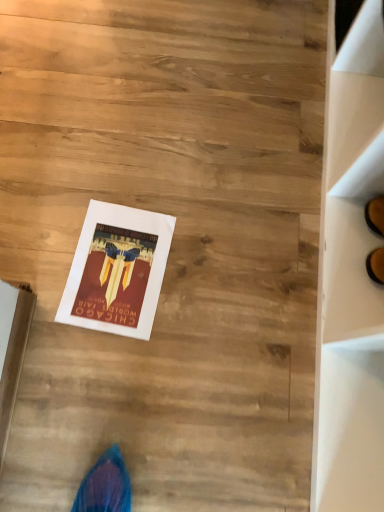
Locate an element on the screen. This screenshot has height=512, width=384. vacant space behind white cardboard box at lower left is located at coordinates (56, 278).